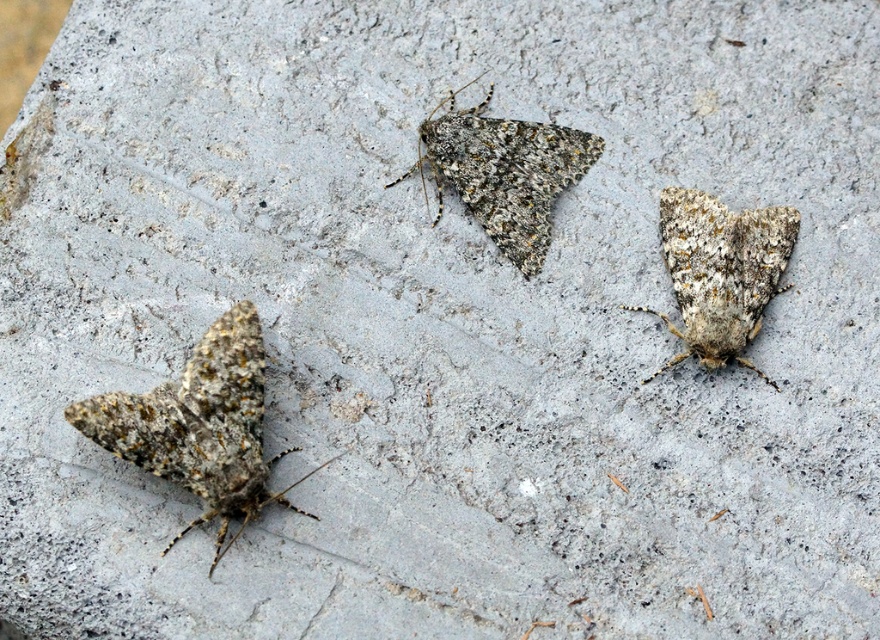
You are a GUI agent. You are given a task and a screenshot of the screen. Output one action in this format:
    pyautogui.click(x=<x>, y=<y>)
    Task: Click on the speckled brown moth at lower left
    Image resolution: width=880 pixels, height=640 pixels.
    Given the screenshot: What is the action you would take?
    pyautogui.click(x=199, y=426)

Who is higher up, speckled brown moth at lower left or speckled brown moth at center?

Positioned higher is speckled brown moth at center.

Which is in front, point (281, 499) or point (468, 113)?

Point (281, 499) is in front.

This screenshot has width=880, height=640. Find the location of `speckled brown moth at lower left`. speckled brown moth at lower left is located at coordinates (199, 426).

Describe the element at coordinates (504, 172) in the screenshot. I see `speckled brown moth at center` at that location.

Is speckled brown moth at center above speckled brown moth at right?

Yes, speckled brown moth at center is above speckled brown moth at right.

Where is `speckled brown moth at center`? speckled brown moth at center is located at coordinates (504, 172).

The width and height of the screenshot is (880, 640). I want to click on speckled brown moth at center, so click(504, 172).

Who is shorter, speckled brown moth at lower left or speckled brown moth at right?

speckled brown moth at right

Looking at this image, who is more distant from viewer, (x=211, y=464) or (x=796, y=225)?

Positioned behind is point (x=796, y=225).

Find the location of a particular element. speckled brown moth at lower left is located at coordinates (199, 426).